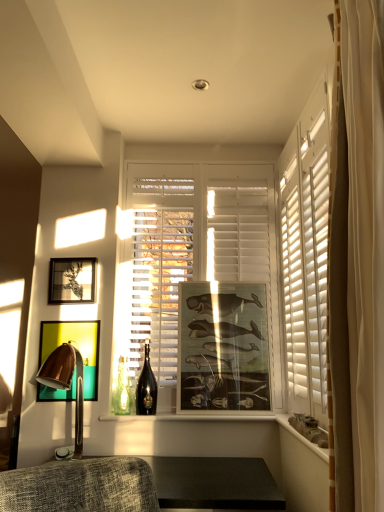
Locate an element on the screen. white matte window at center is located at coordinates (197, 251).

You are a GUI agent. You are given a task and a screenshot of the screen. Output one action in this format:
    pyautogui.click(x=<x>, y=<y>)
    Task: Click on the metallic gold picture frame at left, which ranks as the 2th picture frame in right-to-left order
    This screenshot has height=512, width=384.
    Given the screenshot: What is the action you would take?
    pyautogui.click(x=75, y=347)

The image size is (384, 512). Identify the location of shiny dark glass bottle at center. (146, 387).

Describe the element at coordinates (223, 347) in the screenshot. I see `matte wooden picture frame at center, which appears as the first picture frame when viewed from the right` at that location.

Measure the distance between matte wooden picture frame at center, positioned as the 3th picture frame in left-to-right order, and camera.

They are 7.47 feet apart.

Locate an element on the screen. Image resolution: width=384 pixels, height=512 pixels. white glossy window sill at center is located at coordinates [196, 417].

I want to click on copper metallic table lamp at left, so click(x=66, y=382).

Which object is positioned more to the right, white glossy window sill at center or matte black picture frame at upper left, arranged as the 1th picture frame when viewed from the left?

From the viewer's perspective, white glossy window sill at center appears more on the right side.

Looking at this image, how different are the orientations of white glossy window sill at center and matte black picture frame at upper left, arranged as the 1th picture frame when viewed from the left, in degrees?

0.44 degrees.

Which is less distant, (x=154, y=417) or (x=94, y=298)?

The point (x=154, y=417) is more forward.

This screenshot has width=384, height=512. Find the location of `the 3rd picture frame above the copper metallic table lamp at left (from the image's perspective)`. the 3rd picture frame above the copper metallic table lamp at left (from the image's perspective) is located at coordinates (72, 280).

Considering the sizes of objects matte black picture frame at upper left, the 3th picture frame in the right-to-left sequence, and copper metallic table lamp at left in the image provided, who is taller, matte black picture frame at upper left, the 3th picture frame in the right-to-left sequence, or copper metallic table lamp at left?

copper metallic table lamp at left is taller.

Could you tell me if matte black picture frame at upper left, arranged as the 1th picture frame when viewed from the left, is facing copper metallic table lamp at left?

No, matte black picture frame at upper left, arranged as the 1th picture frame when viewed from the left, is not facing towards copper metallic table lamp at left.

Which object is closer to the camera, matte black picture frame at upper left, the 3th picture frame in the right-to-left sequence, or copper metallic table lamp at left?

copper metallic table lamp at left is closer to the camera.

Could you tell me if matte black picture frame at upper left, arranged as the 1th picture frame when viewed from the left, is facing matte wooden picture frame at center, which appears as the first picture frame when viewed from the right?

No, matte black picture frame at upper left, arranged as the 1th picture frame when viewed from the left, is not facing towards matte wooden picture frame at center, which appears as the first picture frame when viewed from the right.

Which of these two, matte black picture frame at upper left, arranged as the 1th picture frame when viewed from the left, or matte wooden picture frame at center, positioned as the 3th picture frame in left-to-right order, is smaller?

matte black picture frame at upper left, arranged as the 1th picture frame when viewed from the left.

From the image's perspective, between matte black picture frame at upper left, arranged as the 1th picture frame when viewed from the left, and matte wooden picture frame at center, which appears as the first picture frame when viewed from the right, who is located below?

matte wooden picture frame at center, which appears as the first picture frame when viewed from the right, appears lower in the image.

Starting from the matte wooden picture frame at center, which appears as the first picture frame when viewed from the right, which picture frame is the 2nd one to the left? Please provide its 2D coordinates.

[(72, 280)]

Between wooden ledge at lower right and copper metallic table lamp at left, which one has larger size?

Bigger between the two is copper metallic table lamp at left.

Is wooden ledge at lower right situated inside copper metallic table lamp at left or outside?

The correct answer is: outside.

Which object is thinner, wooden ledge at lower right or copper metallic table lamp at left?

With smaller width is wooden ledge at lower right.

Where is `the 1st picture frame behind the wooden ledge at lower right`? This screenshot has width=384, height=512. the 1st picture frame behind the wooden ledge at lower right is located at coordinates (75, 347).

Would you consider metallic gold picture frame at left, which ranks as the 2th picture frame in right-to-left order, to be distant from wooden ledge at lower right?

Yes, metallic gold picture frame at left, which ranks as the 2th picture frame in right-to-left order, and wooden ledge at lower right are quite far apart.

Which object is positioned more to the right, metallic gold picture frame at left, which ranks as the 2th picture frame in right-to-left order, or wooden ledge at lower right?

Positioned to the right is wooden ledge at lower right.

From a real-world perspective, which is physically above, white glossy window sill at center or matte wooden picture frame at center, which appears as the first picture frame when viewed from the right?

From a 3D spatial view, matte wooden picture frame at center, which appears as the first picture frame when viewed from the right, is above.

Is white glossy window sill at center at the right side of matte wooden picture frame at center, which appears as the first picture frame when viewed from the right?

No, white glossy window sill at center is not to the right of matte wooden picture frame at center, which appears as the first picture frame when viewed from the right.

Between white glossy window sill at center and matte wooden picture frame at center, positioned as the 3th picture frame in left-to-right order, which one has larger size?

matte wooden picture frame at center, positioned as the 3th picture frame in left-to-right order, is bigger.

Is matte wooden picture frame at center, positioned as the 3th picture frame in left-to-right order, positioned in front of wooden ledge at lower right?

No, it is not.

Considering the sizes of objects matte wooden picture frame at center, positioned as the 3th picture frame in left-to-right order, and wooden ledge at lower right in the image provided, who is thinner, matte wooden picture frame at center, positioned as the 3th picture frame in left-to-right order, or wooden ledge at lower right?

matte wooden picture frame at center, positioned as the 3th picture frame in left-to-right order.

Does point (180, 371) lie behind point (287, 416)?

That is True.

Is matte wooden picture frame at center, positioned as the 3th picture frame in left-to-right order, oriented towards wooden ledge at lower right?

Yes, matte wooden picture frame at center, positioned as the 3th picture frame in left-to-right order, is turned towards wooden ledge at lower right.

Image resolution: width=384 pixels, height=512 pixels. What are the coordinates of `window sill below the matte black picture frame at upper left, the 3th picture frame in the right-to-left sequence (from the image's perspective)` in the screenshot? It's located at (196, 417).

The width and height of the screenshot is (384, 512). In order to click on the 3rd picture frame behind the copper metallic table lamp at left in this screenshot , I will do `click(72, 280)`.

Considering their positions, is copper metallic table lamp at left positioned further to shiny dark glass bottle at center than white matte window at center?

white matte window at center is further to shiny dark glass bottle at center.

Estimate the real-world distances between objects in this image. Which object is further from white glossy window sill at center, matte wooden picture frame at center, which appears as the first picture frame when viewed from the right, or white matte window at center?

The object further to white glossy window sill at center is white matte window at center.

Which object lies nearer to the anchor point matte wooden picture frame at center, which appears as the first picture frame when viewed from the right, metallic gold picture frame at left, which is counted as the second picture frame, starting from the left, or matte black picture frame at upper left, arranged as the 1th picture frame when viewed from the left?

metallic gold picture frame at left, which is counted as the second picture frame, starting from the left, is positioned closer to the anchor matte wooden picture frame at center, which appears as the first picture frame when viewed from the right.

Estimate the real-world distances between objects in this image. Which object is closer to matte wooden picture frame at center, which appears as the first picture frame when viewed from the right, shiny dark glass bottle at center or white glossy window sill at center?

white glossy window sill at center lies closer to matte wooden picture frame at center, which appears as the first picture frame when viewed from the right, than the other object.

Looking at this image, which object lies further to the anchor point matte black picture frame at upper left, arranged as the 1th picture frame when viewed from the left, white matte window at center or matte wooden picture frame at center, positioned as the 3th picture frame in left-to-right order?

matte wooden picture frame at center, positioned as the 3th picture frame in left-to-right order, is positioned further to the anchor matte black picture frame at upper left, arranged as the 1th picture frame when viewed from the left.

Considering their positions, is metallic gold picture frame at left, which is counted as the second picture frame, starting from the left, positioned further to matte black picture frame at upper left, the 3th picture frame in the right-to-left sequence, than matte wooden picture frame at center, positioned as the 3th picture frame in left-to-right order?

Based on the image, matte wooden picture frame at center, positioned as the 3th picture frame in left-to-right order, appears to be further to matte black picture frame at upper left, the 3th picture frame in the right-to-left sequence.

Based on their spatial positions, is metallic gold picture frame at left, which ranks as the 2th picture frame in right-to-left order, or matte wooden picture frame at center, positioned as the 3th picture frame in left-to-right order, closer to copper metallic table lamp at left?

The object closer to copper metallic table lamp at left is metallic gold picture frame at left, which ranks as the 2th picture frame in right-to-left order.

Which object lies further to the anchor point shiny dark glass bottle at center, metallic gold picture frame at left, which ranks as the 2th picture frame in right-to-left order, or matte wooden picture frame at center, which appears as the first picture frame when viewed from the right?

Among the two, matte wooden picture frame at center, which appears as the first picture frame when viewed from the right, is located further to shiny dark glass bottle at center.

Locate an element on the screen. window sill located between wooden ledge at lower right and white matte window at center in the depth direction is located at coordinates (196, 417).

At what (x,y) coordinates should I click in order to perform the action: click on table lamp between metallic gold picture frame at left, which is counted as the second picture frame, starting from the left, and white matte window at center. Please return your answer as a coordinate pair (x, y). This screenshot has height=512, width=384. Looking at the image, I should click on (66, 382).

This screenshot has height=512, width=384. Identify the location of table lamp situated between matte black picture frame at upper left, arranged as the 1th picture frame when viewed from the left, and white matte window at center from left to right. (66, 382).

I want to click on beer bottle located between matte black picture frame at upper left, the 3th picture frame in the right-to-left sequence, and white matte window at center in the left-right direction, so click(146, 387).